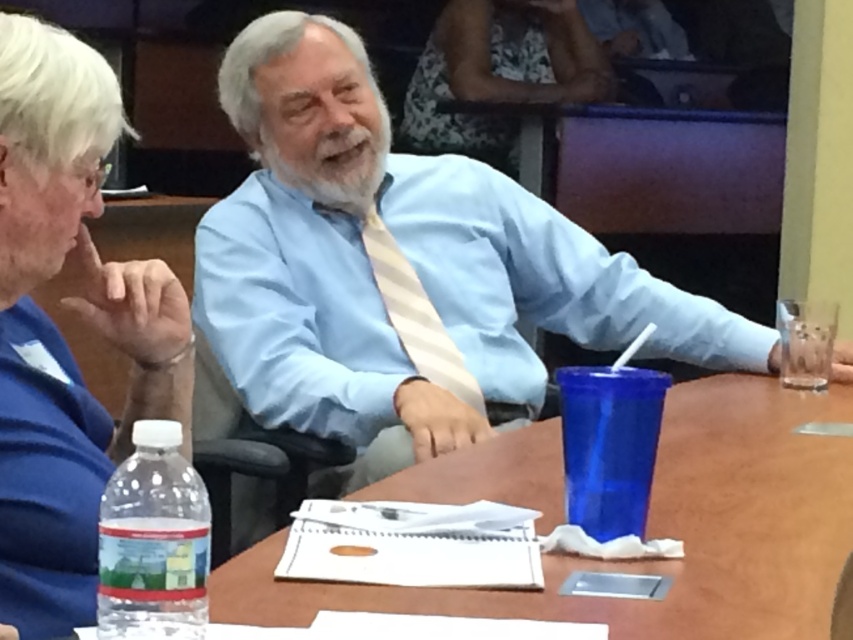
Question: Can you confirm if light blue shirt at center is wider than blue fabric shirt at upper left?

Choices:
 (A) yes
 (B) no

Answer: (A)

Question: Is light blue shirt at center positioned in front of wooden table at center?

Choices:
 (A) yes
 (B) no

Answer: (B)

Question: Can you confirm if white floral dress at upper center is positioned above light beige striped tie at center?

Choices:
 (A) no
 (B) yes

Answer: (B)

Question: Which object is positioned farthest from the blue fabric shirt at upper left?

Choices:
 (A) light beige striped tie at center
 (B) wooden table at center
 (C) light blue shirt at center

Answer: (A)

Question: Which object is farther from the camera taking this photo?

Choices:
 (A) light beige striped tie at center
 (B) white floral dress at upper center
 (C) wooden table at center
 (D) light blue shirt at center

Answer: (B)

Question: Which point is farther to the camera?

Choices:
 (A) white floral dress at upper center
 (B) wooden table at center
 (C) light beige striped tie at center

Answer: (A)